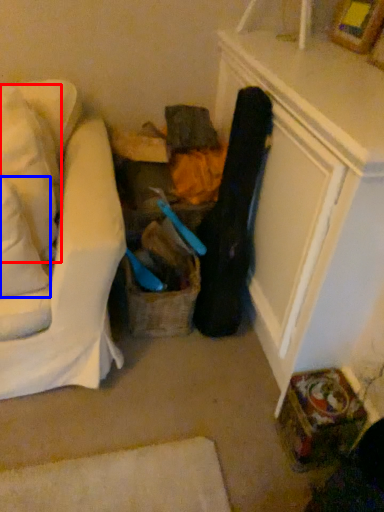
Question: Which point is closer to the camera, pillow (highlighted by a red box) or pillow (highlighted by a blue box)?

Choices:
 (A) pillow
 (B) pillow

Answer: (B)